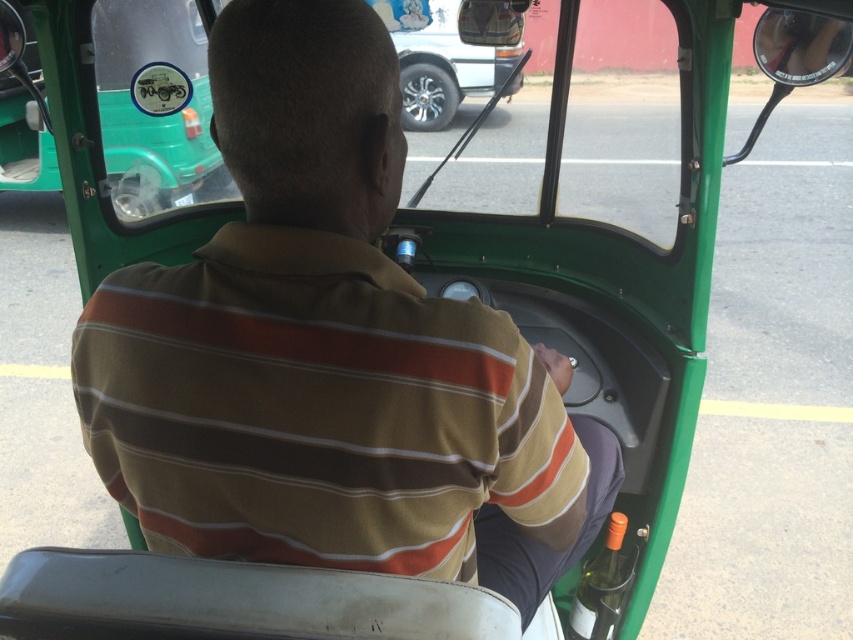
You are a passenger in the auto rickshaw and want to place a small bag on the seat. The seat is represented by the point at the center of the image. Is the point at (329, 353) on the seat?

The brown striped shirt at center is represented by point (329, 353). Since the shirt is on the driver, the point is not on the seat.

You are a passenger in the auto rickshaw and want to locate the driver. Where is the driver positioned relative to the brown striped shirt at center?

The driver is sitting in front of the brown striped shirt at center, as the shirt is part of the driver himself, so the driver is directly in front of the shirt.